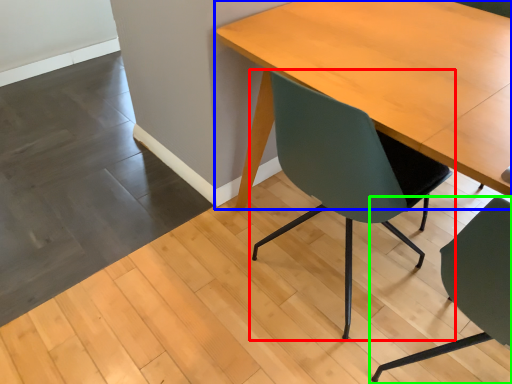
Question: Considering the real-world distances, which object is closest to chair (highlighted by a red box)? table (highlighted by a blue box) or chair (highlighted by a green box).

Choices:
 (A) table
 (B) chair

Answer: (A)